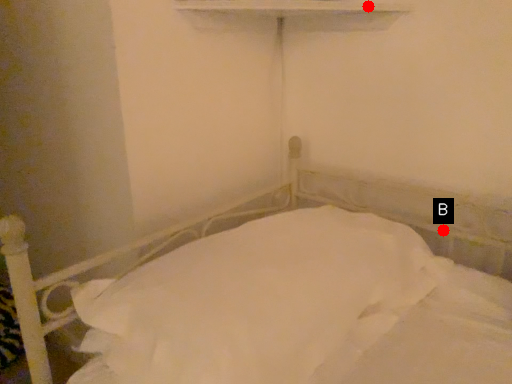
Question: Two points are circled on the image, labeled by A and B beside each circle. Which point appears farthest from the camera in this image?

Choices:
 (A) A is further
 (B) B is further

Answer: (B)